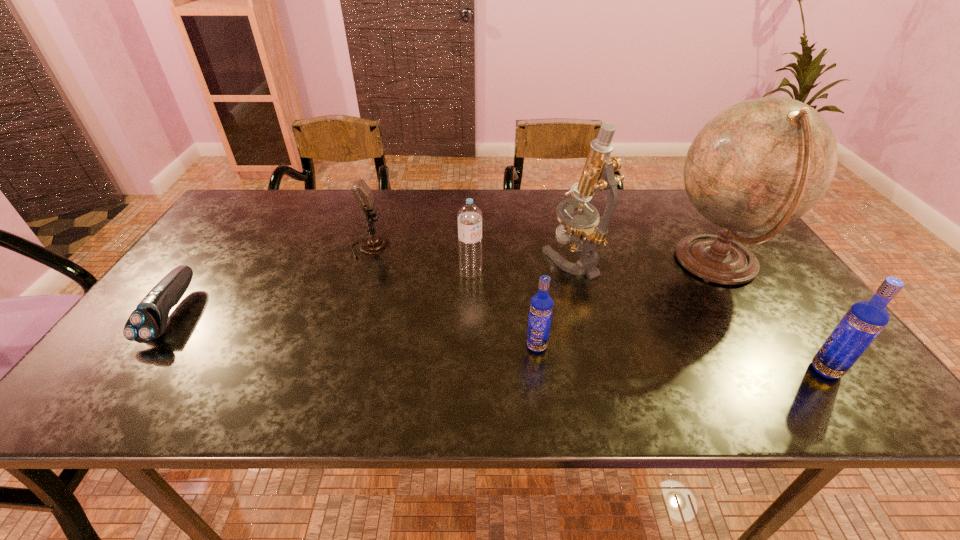
You are a GUI agent. You are given a task and a screenshot of the screen. Output one action in this format:
    pyautogui.click(x=<x>, y=<y>)
    Task: Click on the shorter vodka
    The width and height of the screenshot is (960, 540).
    Given the screenshot: What is the action you would take?
    pyautogui.click(x=541, y=305)

I want to click on the left vodka, so click(x=541, y=305).

You are a GUI agent. You are given a task and a screenshot of the screen. Output one action in this format:
    pyautogui.click(x=<x>, y=<y>)
    Task: Click on the right vodka
    The height and width of the screenshot is (540, 960).
    Given the screenshot: What is the action you would take?
    pyautogui.click(x=863, y=322)

The width and height of the screenshot is (960, 540). In order to click on the nearest object in this screenshot , I will do `click(863, 322)`.

You are a GUI agent. You are given a task and a screenshot of the screen. Output one action in this format:
    pyautogui.click(x=<x>, y=<y>)
    Task: Click on the microphone
    The height and width of the screenshot is (540, 960).
    Given the screenshot: What is the action you would take?
    pos(362,194)

Where is `microscope`? microscope is located at coordinates (583, 232).

Find the location of a particular element. the leftmost object is located at coordinates (148, 321).

At what (x,y) coordinates should I click in order to perform the action: click on the shortest object. Please return your answer as a coordinate pair (x, y). The image size is (960, 540). Looking at the image, I should click on (148, 321).

Where is `globe`? globe is located at coordinates (760, 164).

Identify the location of water bottle. The height and width of the screenshot is (540, 960). (469, 216).